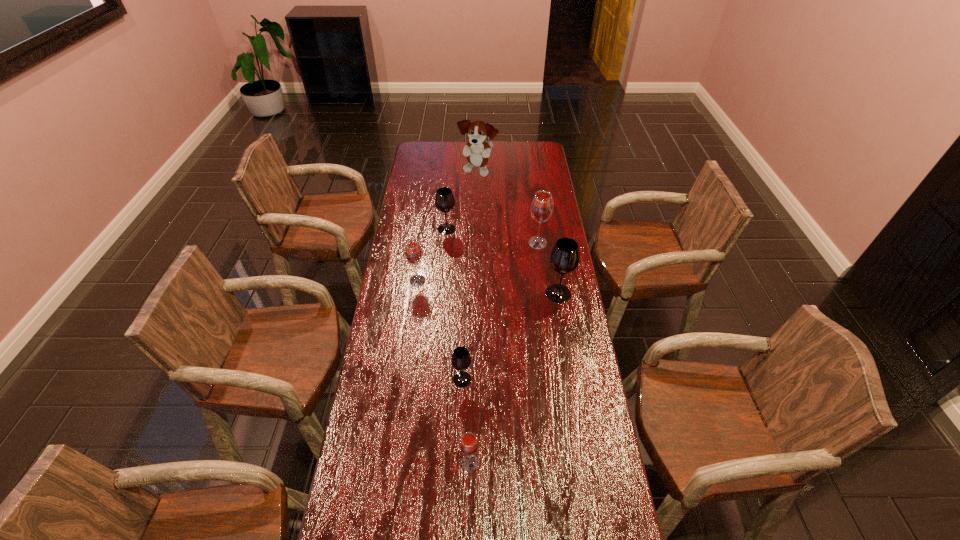
Find the location of `empty space between the second gray wineglass from left to right and the leftmost red wineglass`. empty space between the second gray wineglass from left to right and the leftmost red wineglass is located at coordinates (440, 330).

Image resolution: width=960 pixels, height=540 pixels. I want to click on empty space between the smallest red wineglass and the brown puppy, so click(474, 318).

Image resolution: width=960 pixels, height=540 pixels. Find the location of `blank region between the puppy and the fifth nearest wineglass`. blank region between the puppy and the fifth nearest wineglass is located at coordinates (508, 207).

Where is `free space between the second red wineglass from left to right and the leftmost red wineglass`? free space between the second red wineglass from left to right and the leftmost red wineglass is located at coordinates (444, 372).

Locate which object ranks second in proximity to the third farthest object. Please provide its 2D coordinates. Your answer should be formatted as a tuple, i.e. [(x, y)], where the tuple contains the x and y coordinates of a point satisfying the conditions above.

[(444, 200)]

I want to click on object that can be found as the fourth closest to the smallest gray wineglass, so click(542, 205).

Point out which wineglass is positioned as the fourth nearest to the biggest gray wineglass. Please provide its 2D coordinates. Your answer should be formatted as a tuple, i.e. [(x, y)], where the tuple contains the x and y coordinates of a point satisfying the conditions above.

[(444, 200)]

Where is `wineglass identified as the fifth closest to the biggest gray wineglass`? The image size is (960, 540). wineglass identified as the fifth closest to the biggest gray wineglass is located at coordinates (469, 445).

Choose which red wineglass is the nearest neighbor to the biggest red wineglass. Please provide its 2D coordinates. Your answer should be formatted as a tuple, i.e. [(x, y)], where the tuple contains the x and y coordinates of a point satisfying the conditions above.

[(413, 252)]

Identify which red wineglass is the second closest to the second nearest red wineglass. Please provide its 2D coordinates. Your answer should be formatted as a tuple, i.e. [(x, y)], where the tuple contains the x and y coordinates of a point satisfying the conditions above.

[(469, 445)]